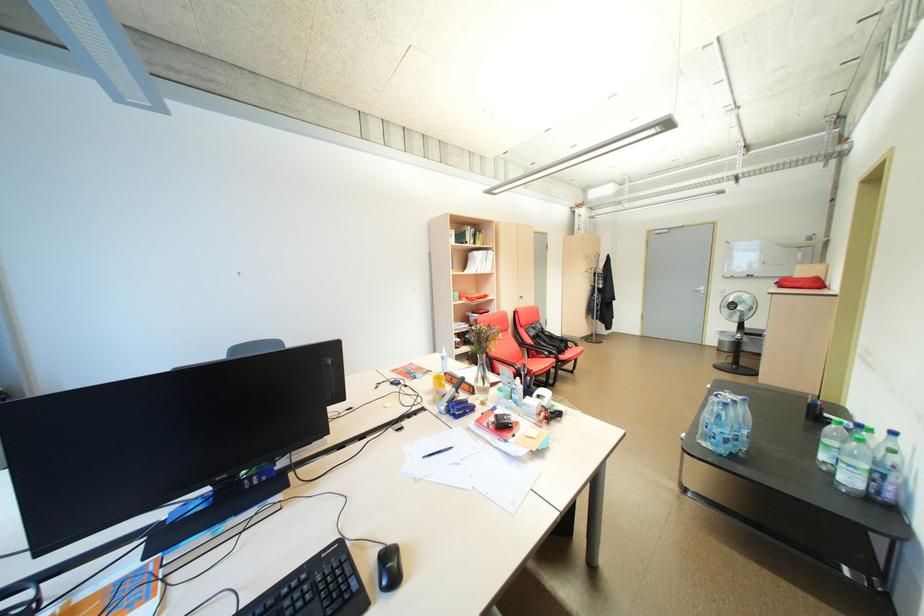
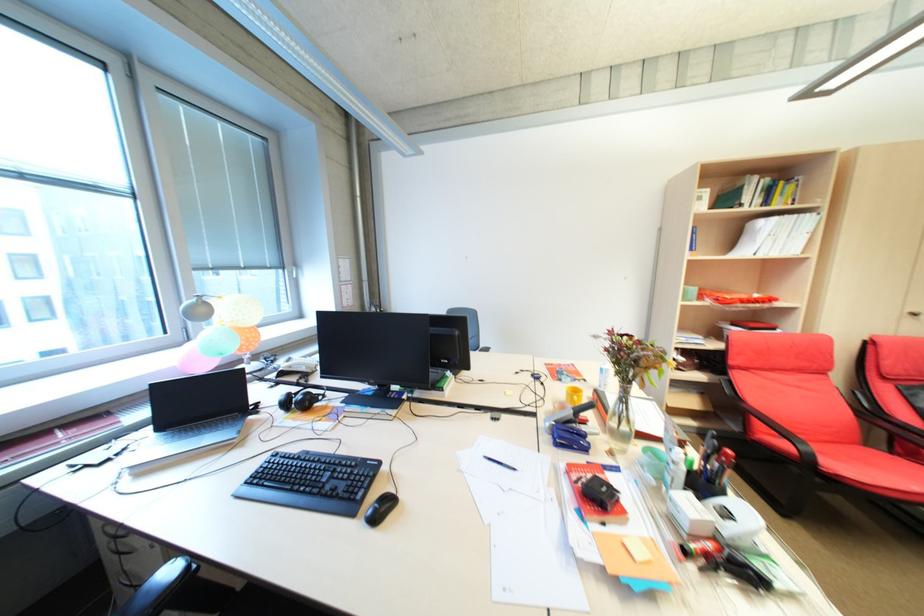
In the second image, find the point that corresponds to point (466, 418) in the first image.

(565, 445)